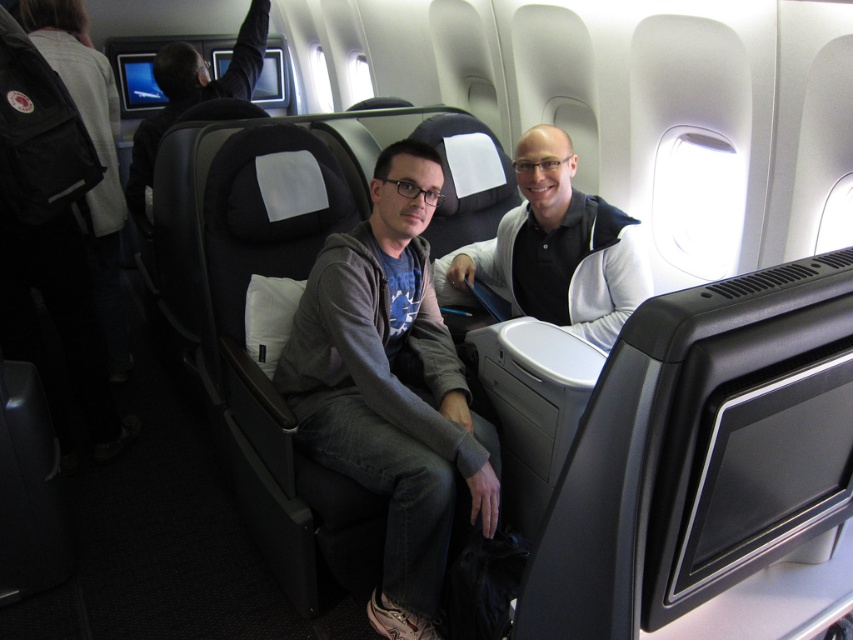
Question: Is dark gray hoodie at center smaller than black leather seat at upper left?

Choices:
 (A) yes
 (B) no

Answer: (A)

Question: Which point is closer to the camera?

Choices:
 (A) (204, 92)
 (B) (614, 336)

Answer: (B)

Question: Is gray hoodie at center to the left of dark gray hoodie at center from the viewer's perspective?

Choices:
 (A) no
 (B) yes

Answer: (B)

Question: Which object appears farthest from the camera in this image?

Choices:
 (A) dark gray hoodie at center
 (B) gray hoodie at center

Answer: (A)

Question: Is gray hoodie at center thinner than black leather seat at upper left?

Choices:
 (A) no
 (B) yes

Answer: (A)

Question: Which point appears closest to the camera in this image?

Choices:
 (A) (532, 252)
 (B) (329, 237)
 (C) (143, 208)

Answer: (B)